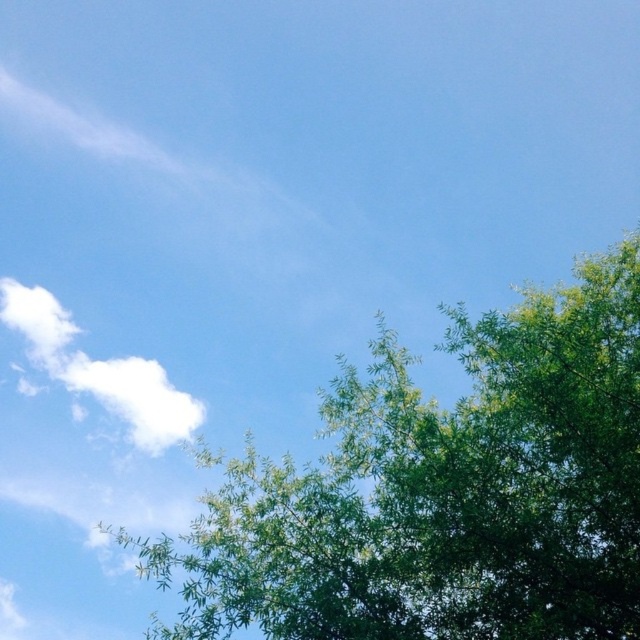
From the picture: Who is more distant from viewer, (256,612) or (134,416)?

The point (134,416) is more distant.

In the scene shown: Is green leafy tree at upper center in front of white fluffy cloud at upper left?

That is True.

Is point (564, 556) farther from camera compared to point (122, 369)?

No, it is in front of (122, 369).

Where is `green leafy tree at upper center`? The width and height of the screenshot is (640, 640). green leafy tree at upper center is located at coordinates (442, 492).